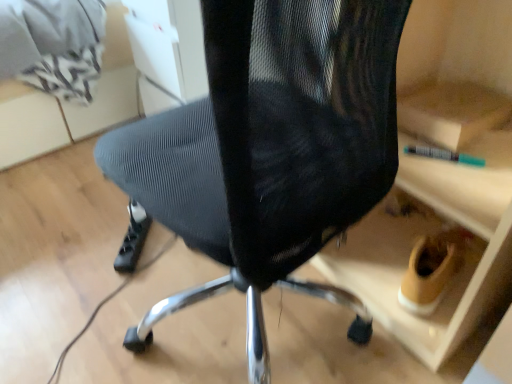
Question: Considering the positions of black mesh chair at center and black plastic power strip at lower left in the image, is black mesh chair at center wider or thinner than black plastic power strip at lower left?

Choices:
 (A) wide
 (B) thin

Answer: (A)

Question: Is black mesh chair at center taller or shorter than black plastic power strip at lower left?

Choices:
 (A) tall
 (B) short

Answer: (A)

Question: Estimate the real-world distances between objects in this image. Which object is farther from the black mesh chair at center?

Choices:
 (A) matte gray mesh chair at upper center
 (B) black plastic power strip at lower left

Answer: (A)

Question: Estimate the real-world distances between objects in this image. Which object is farther from the black plastic power strip at lower left?

Choices:
 (A) matte gray mesh chair at upper center
 (B) black mesh chair at center

Answer: (B)